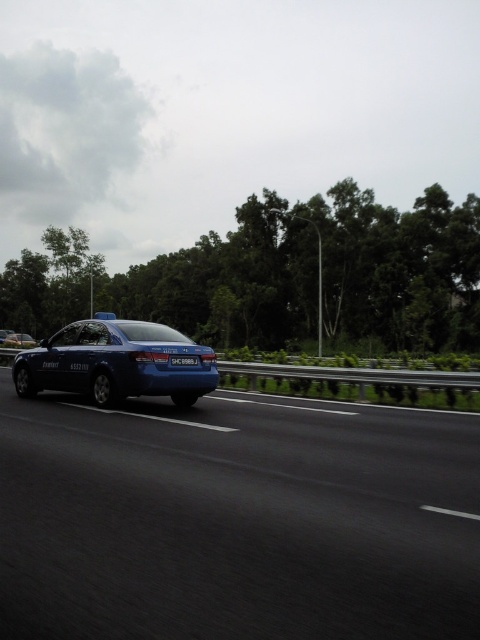
Question: Can you confirm if blue plastic license plate at rear is positioned below blue glossy sedan at left?

Choices:
 (A) yes
 (B) no

Answer: (A)

Question: Which object is closer to the camera taking this photo?

Choices:
 (A) blue glossy car at center
 (B) blue plastic license plate at rear
 (C) blue metallic car at left

Answer: (A)

Question: Does blue glossy car at center have a smaller size compared to blue metallic car at left?

Choices:
 (A) yes
 (B) no

Answer: (A)

Question: Which object appears closest to the camera in this image?

Choices:
 (A) blue glossy sedan at left
 (B) blue plastic license plate at rear

Answer: (B)

Question: Which object appears closest to the camera in this image?

Choices:
 (A) blue plastic license plate at rear
 (B) blue glossy car at center
 (C) blue metallic car at left
 (D) blue glossy sedan at left

Answer: (B)

Question: Is matte blue sedan at left wider than blue metallic car at left?

Choices:
 (A) yes
 (B) no

Answer: (B)